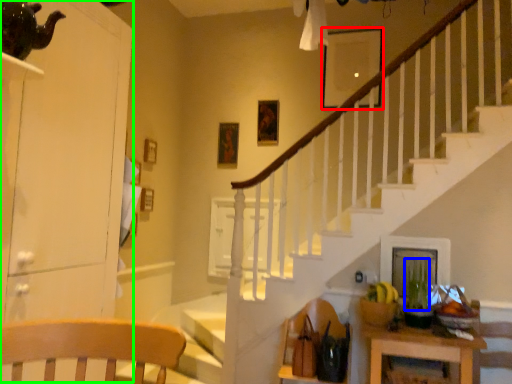
Question: Considering the real-world distances, which object is closest to picture frame (highlighted by a red box)? plant (highlighted by a blue box) or dresser (highlighted by a green box).

Choices:
 (A) plant
 (B) dresser

Answer: (A)